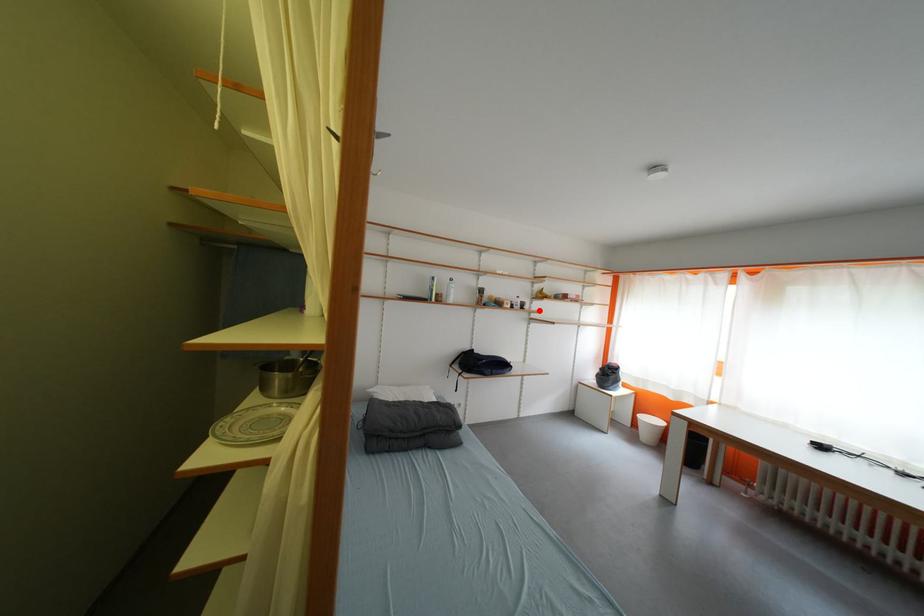
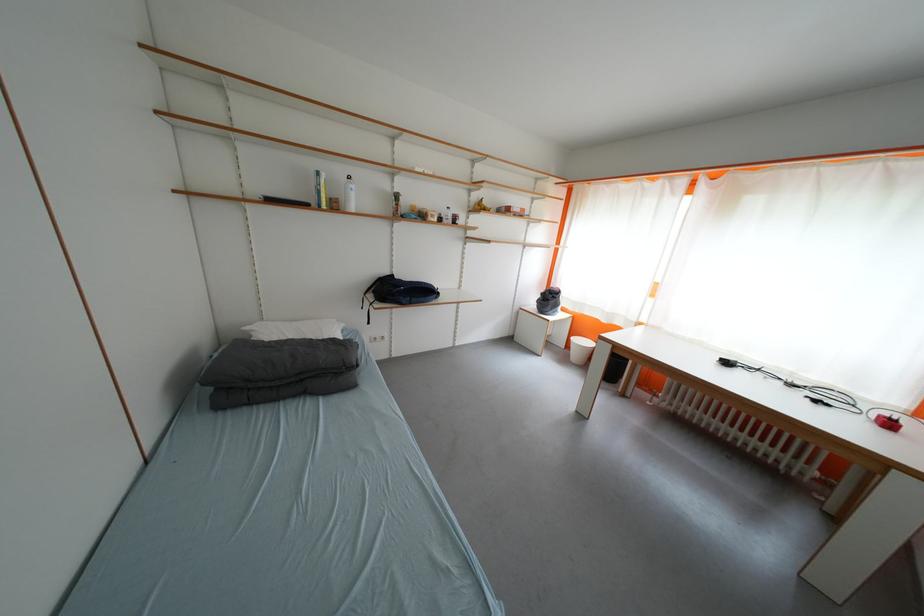
The point at the highlighted location is marked in the first image. Where is the corresponding point in the second image?

(476, 225)